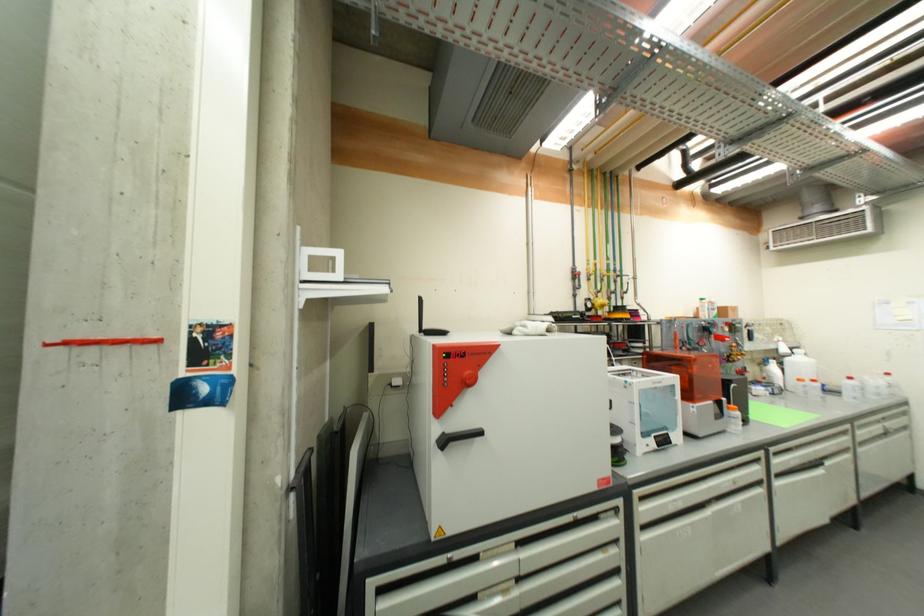
Find the location of a particular element. bottle pump top is located at coordinates (733, 419).